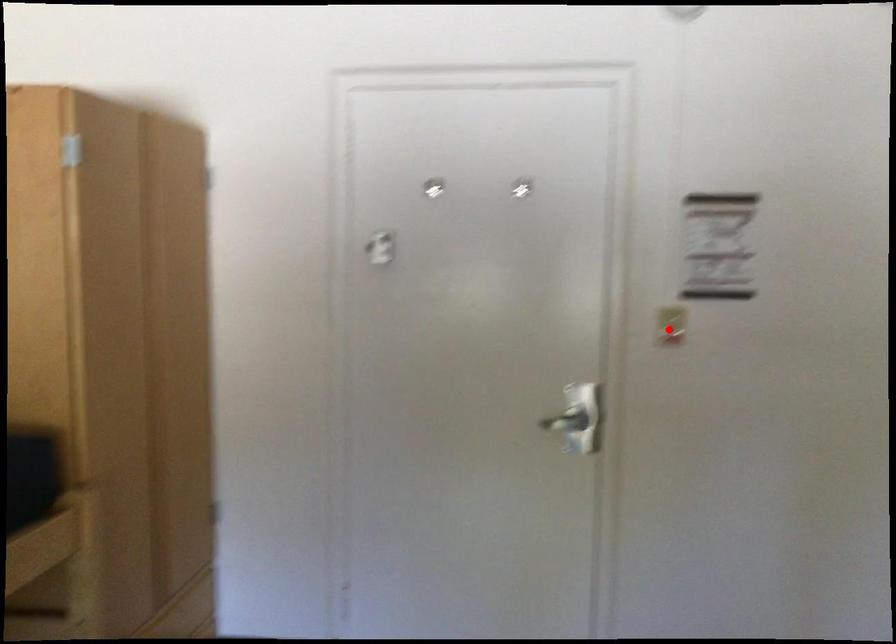
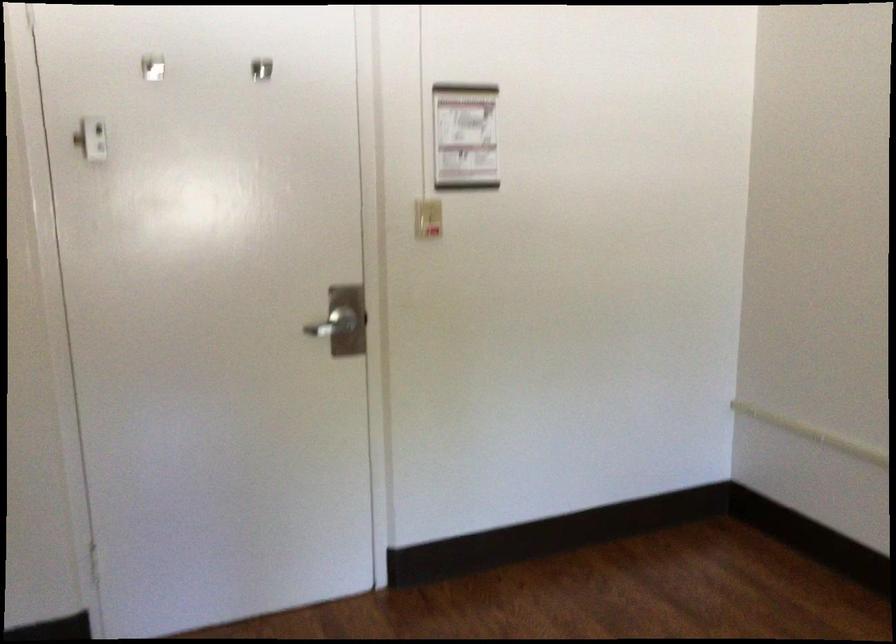
Where in the second image is the point corresponding to the highlighted location from the first image?

(427, 218)